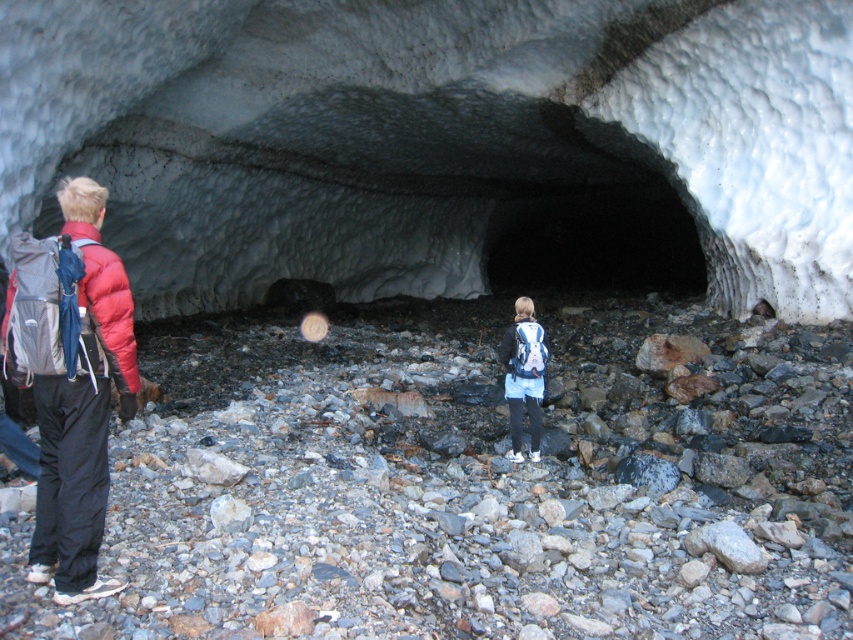
Question: Is white frosty ice cave at center positioned in front of smooth gray rock at center?

Choices:
 (A) yes
 (B) no

Answer: (B)

Question: Is white frosty ice cave at center above matte blue backpack at center?

Choices:
 (A) no
 (B) yes

Answer: (B)

Question: Can you confirm if white frosty ice cave at center is wider than matte red jacket at left?

Choices:
 (A) yes
 (B) no

Answer: (A)

Question: Which point is closer to the camera taking this photo?

Choices:
 (A) (93, 448)
 (B) (436, 564)
 (C) (206, 300)
 (D) (505, 362)

Answer: (A)

Question: Which point is farther to the camera?

Choices:
 (A) white frosty ice cave at center
 (B) matte blue backpack at center
 (C) smooth gray rock at center

Answer: (B)

Question: Among these points, which one is farthest from the camera?

Choices:
 (A) (581, 148)
 (B) (525, 346)
 (C) (590, 554)
 (D) (57, 496)

Answer: (A)